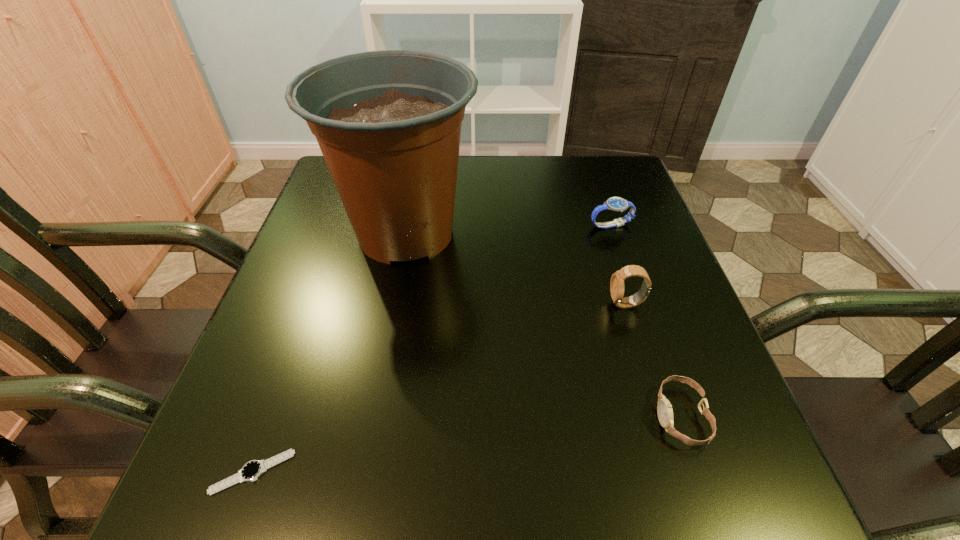
Where is `flowerpot`? This screenshot has width=960, height=540. flowerpot is located at coordinates (388, 123).

Identify the location of the third nearest object. (617, 287).

Locate an element on the screen. This screenshot has width=960, height=540. the second farthest watch is located at coordinates (617, 287).

Identify the location of the farthest watch. The width and height of the screenshot is (960, 540). (617, 204).

This screenshot has width=960, height=540. Identify the location of the third tallest object. (617, 204).

Find the location of a particular element. This screenshot has height=540, width=960. the third tallest watch is located at coordinates (664, 409).

The image size is (960, 540). Identify the location of the leftmost watch. (251, 471).

This screenshot has width=960, height=540. I want to click on the shortest object, so click(251, 471).

The image size is (960, 540). In order to click on free location located on the right of the flowerpot in this screenshot , I will do `click(500, 233)`.

In order to click on blank space located 0.150m on the face of the fourth shortest object in this screenshot , I will do `click(532, 304)`.